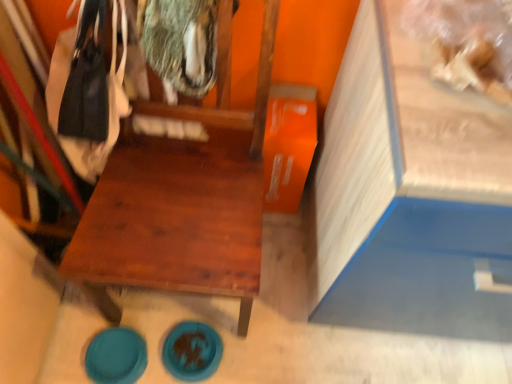
Where is `free point behind teal glossy plate at lower left, which ranks as the 1th plate in left-to-right order`? free point behind teal glossy plate at lower left, which ranks as the 1th plate in left-to-right order is located at coordinates pyautogui.click(x=141, y=312).